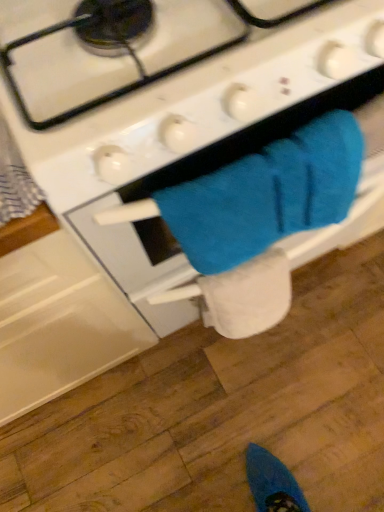
I want to click on white soft toilet paper at lower center, so click(248, 296).

The height and width of the screenshot is (512, 384). What are the coordinates of `white matte gas stove at center` in the screenshot? It's located at (170, 115).

What do you see at coordinates (267, 195) in the screenshot? I see `blue fuzzy towel at center` at bounding box center [267, 195].

At what (x,y) coordinates should I click in order to perform the action: click on white soft toilet paper at lower center. Please return your answer as a coordinate pair (x, y). The height and width of the screenshot is (512, 384). Looking at the image, I should click on (248, 296).

From a real-world perspective, is blue fuzzy towel at center physically below white matte gas stove at center?

No.

How much distance is there between blue fuzzy towel at center and white matte gas stove at center?

3.96 inches.

Is blue fuzzy towel at center wider than white matte gas stove at center?

Incorrect, the width of blue fuzzy towel at center does not surpass that of white matte gas stove at center.

How many degrees apart are the facing directions of blue fuzzy towel at center and white matte gas stove at center?

They differ by 3.47 degrees in their facing directions.

Which object is positioned more to the right, white matte gas stove at center or blue fuzzy towel at center?

blue fuzzy towel at center.

Could you tell me if white matte gas stove at center is facing blue fuzzy towel at center?

Yes, white matte gas stove at center is facing blue fuzzy towel at center.

Can you confirm if white matte gas stove at center is taller than blue fuzzy towel at center?

Indeed, white matte gas stove at center has a greater height compared to blue fuzzy towel at center.

Who is bigger, white matte gas stove at center or blue fuzzy towel at center?

With larger size is white matte gas stove at center.

Looking at this image, is white soft toilet paper at lower center bigger than white matte gas stove at center?

Actually, white soft toilet paper at lower center might be smaller than white matte gas stove at center.

Between white soft toilet paper at lower center and white matte gas stove at center, which one has less height?

With less height is white soft toilet paper at lower center.

Between white soft toilet paper at lower center and white matte gas stove at center, which one appears on the left side from the viewer's perspective?

white matte gas stove at center.

From the picture: Between blue fuzzy towel at center and white soft toilet paper at lower center, which one has less height?

white soft toilet paper at lower center.

Between blue fuzzy towel at center and white soft toilet paper at lower center, which one has larger size?

blue fuzzy towel at center is bigger.

Is point (201, 183) positioned before point (266, 279)?

Yes, point (201, 183) is closer to viewer.

Can you tell me how much blue fuzzy towel at center and white soft toilet paper at lower center differ in facing direction?

0.00211 degrees separate the facing orientations of blue fuzzy towel at center and white soft toilet paper at lower center.

Is point (284, 261) behind point (290, 182)?

Yes, it is behind point (290, 182).

Looking at this image, in terms of height, does white soft toilet paper at lower center look taller or shorter compared to blue fuzzy towel at center?

Clearly, white soft toilet paper at lower center is shorter compared to blue fuzzy towel at center.

Who is bigger, white soft toilet paper at lower center or blue fuzzy towel at center?

With larger size is blue fuzzy towel at center.

From a real-world perspective, which is physically below, white soft toilet paper at lower center or blue fuzzy towel at center?

From a 3D spatial view, white soft toilet paper at lower center is below.

Would you say white matte gas stove at center is inside or outside white soft toilet paper at lower center?

white matte gas stove at center cannot be found inside white soft toilet paper at lower center.

Based on the photo, relative to white soft toilet paper at lower center, is white matte gas stove at center in front or behind?

In the image, white matte gas stove at center appears in front of white soft toilet paper at lower center.

From the image's perspective, is white matte gas stove at center beneath white soft toilet paper at lower center?

No, from the image's perspective, white matte gas stove at center is not below white soft toilet paper at lower center.

Considering the relative sizes of white matte gas stove at center and white soft toilet paper at lower center in the image provided, is white matte gas stove at center taller than white soft toilet paper at lower center?

Correct, white matte gas stove at center is much taller as white soft toilet paper at lower center.

Locate an element on the screen. This screenshot has width=384, height=512. gas stove on the left of blue fuzzy towel at center is located at coordinates (170, 115).

The width and height of the screenshot is (384, 512). In order to click on bath towel on the right of white matte gas stove at center in this screenshot , I will do `click(267, 195)`.

Considering their positions, is white soft toilet paper at lower center positioned further to white matte gas stove at center than blue fuzzy towel at center?

The object further to white matte gas stove at center is white soft toilet paper at lower center.

Which object lies further to the anchor point white soft toilet paper at lower center, blue fuzzy towel at center or white matte gas stove at center?

Based on the image, white matte gas stove at center appears to be further to white soft toilet paper at lower center.

Considering their positions, is white soft toilet paper at lower center positioned further to blue fuzzy towel at center than white matte gas stove at center?

white soft toilet paper at lower center.

Considering their positions, is white matte gas stove at center positioned further to blue fuzzy towel at center than white soft toilet paper at lower center?

Based on the image, white soft toilet paper at lower center appears to be further to blue fuzzy towel at center.

From the image, which object appears to be nearer to white matte gas stove at center, blue fuzzy towel at center or white soft toilet paper at lower center?

blue fuzzy towel at center is closer to white matte gas stove at center.

Which object lies nearer to the anchor point white soft toilet paper at lower center, white matte gas stove at center or blue fuzzy towel at center?

Among the two, blue fuzzy towel at center is located nearer to white soft toilet paper at lower center.

The width and height of the screenshot is (384, 512). What are the coordinates of `bath towel between white matte gas stove at center and white soft toilet paper at lower center in the up-down direction` in the screenshot? It's located at (267, 195).